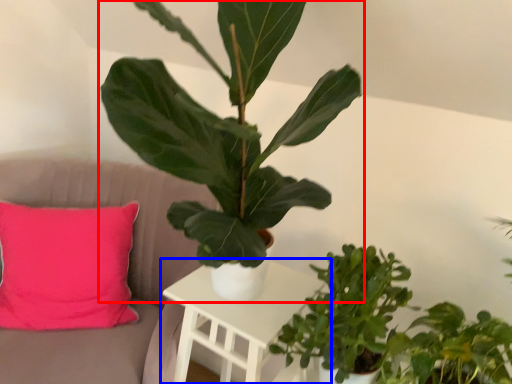
Question: Which object is further to the camera taking this photo, houseplant (highlighted by a red box) or table (highlighted by a blue box)?

Choices:
 (A) houseplant
 (B) table

Answer: (B)